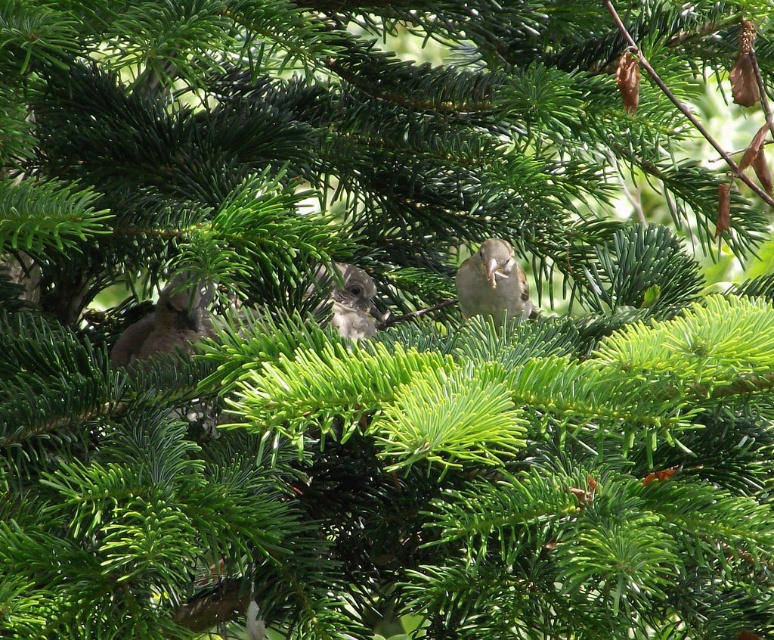
Question: Which point is farther to the camera?

Choices:
 (A) (134, 326)
 (B) (377, 320)

Answer: (B)

Question: Can you confirm if brown feathered bird at left is bigger than brown speckled feathers at center?

Choices:
 (A) yes
 (B) no

Answer: (A)

Question: Among these objects, which one is nearest to the camera?

Choices:
 (A) brown feathered bird at left
 (B) brown feathered bird at center
 (C) brown speckled feathers at center

Answer: (A)

Question: Considering the relative positions of brown feathered bird at left and brown speckled feathers at center in the image provided, where is brown feathered bird at left located with respect to brown speckled feathers at center?

Choices:
 (A) right
 (B) left

Answer: (B)

Question: Is brown feathered bird at left bigger than brown speckled feathers at center?

Choices:
 (A) yes
 (B) no

Answer: (A)

Question: Which point is closer to the camera?

Choices:
 (A) brown feathered bird at left
 (B) brown feathered bird at center

Answer: (A)